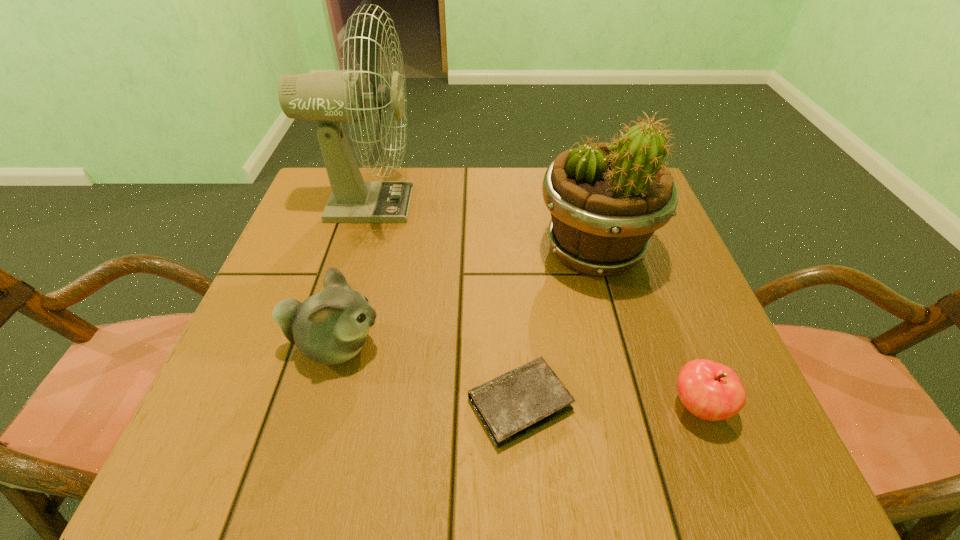
This screenshot has width=960, height=540. What are the coordinates of `fan present at the far edge` in the screenshot? It's located at (331, 98).

At what (x,y) coordinates should I click in order to perform the action: click on flowerpot located in the far edge section of the desktop. Please return your answer as a coordinate pair (x, y). The height and width of the screenshot is (540, 960). Looking at the image, I should click on (606, 200).

Identify the location of apple present at the near edge. Image resolution: width=960 pixels, height=540 pixels. [711, 391].

This screenshot has height=540, width=960. Find the location of `diary that is at the near edge`. diary that is at the near edge is located at coordinates (515, 403).

At what (x,y) coordinates should I click in order to perform the action: click on fan that is at the left edge. Please return your answer as a coordinate pair (x, y). Image resolution: width=960 pixels, height=540 pixels. Looking at the image, I should click on (331, 98).

Locate an element on the screen. hamster present at the left edge is located at coordinates (330, 327).

The width and height of the screenshot is (960, 540). What are the coordinates of `flowerpot present at the right edge` in the screenshot? It's located at (606, 200).

Identify the location of apple located in the right edge section of the desktop. The height and width of the screenshot is (540, 960). (711, 391).

The image size is (960, 540). Identify the location of object that is at the far left corner. [331, 98].

At what (x,y) coordinates should I click in order to perform the action: click on object positioned at the far right corner. Please return your answer as a coordinate pair (x, y). The image size is (960, 540). Looking at the image, I should click on (606, 200).